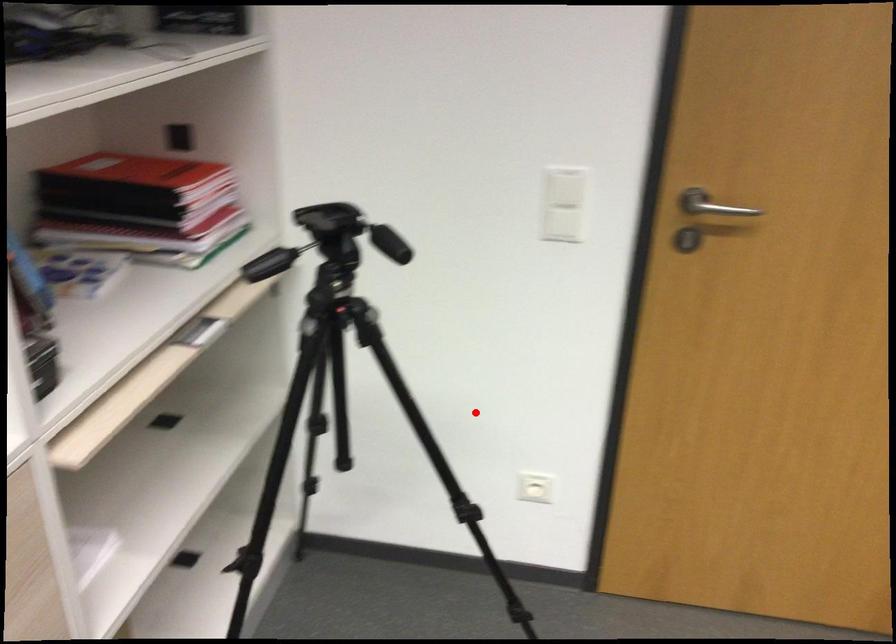
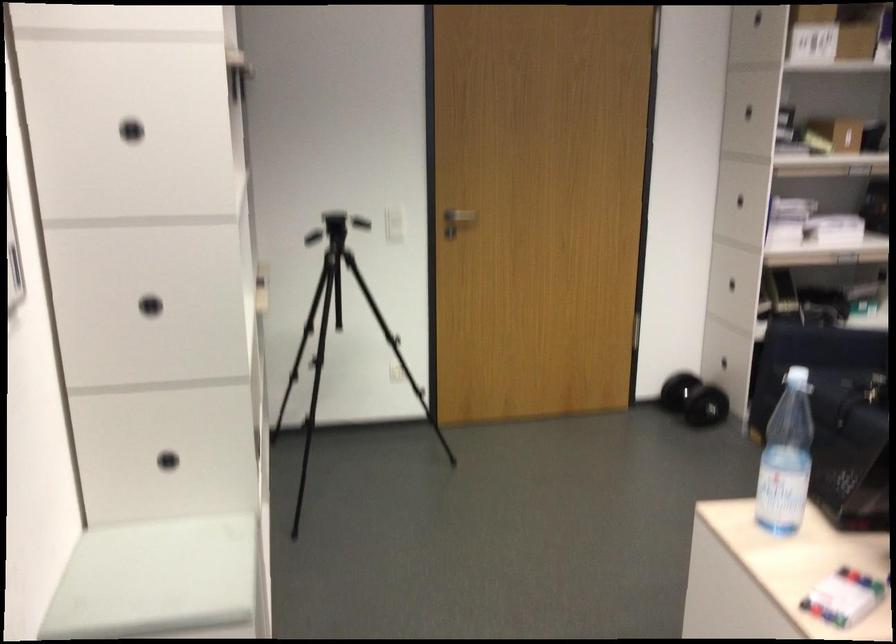
Question: I am providing you with two images of the same scene from different viewpoints. Image1 has a red point marked. In image2, the corresponding 3D location appears at what relative position? Reply with the corresponding letter.

Choices:
 (A) Closer
 (B) Farther

Answer: (B)